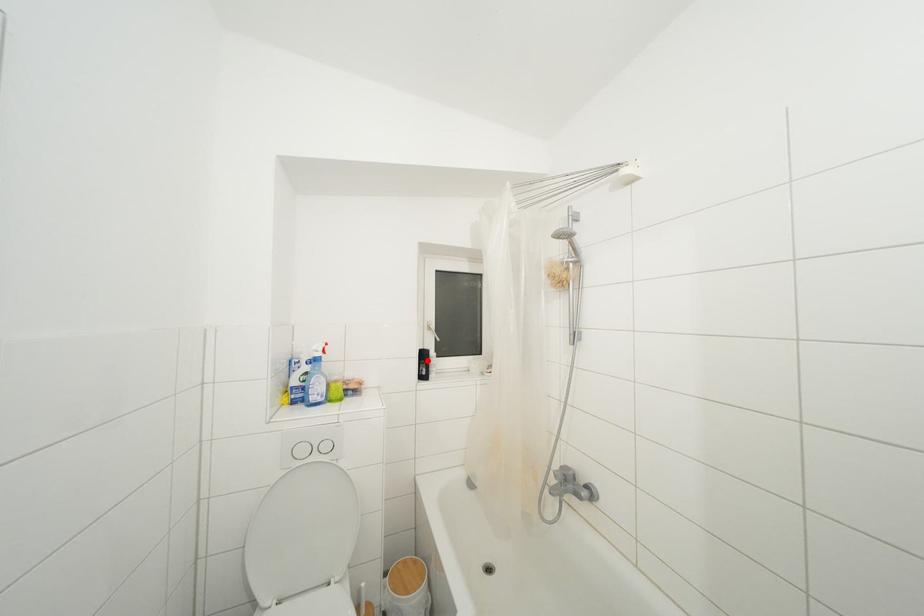
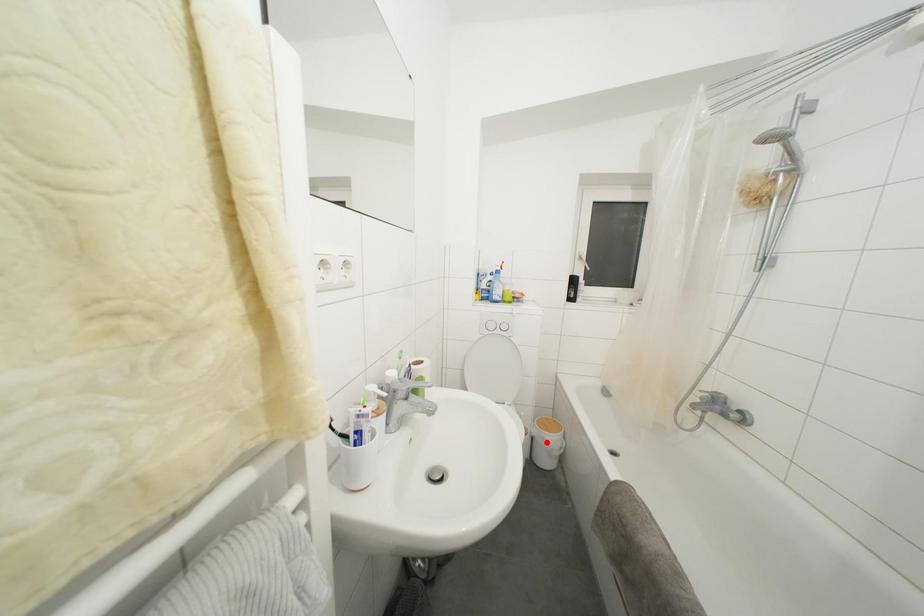
I am providing you with two images of the same scene from different viewpoints. A red point is marked on the first image and another point is marked on the second image. Do the highlighted points in image1 and image2 indicate the same real-world spot?

No